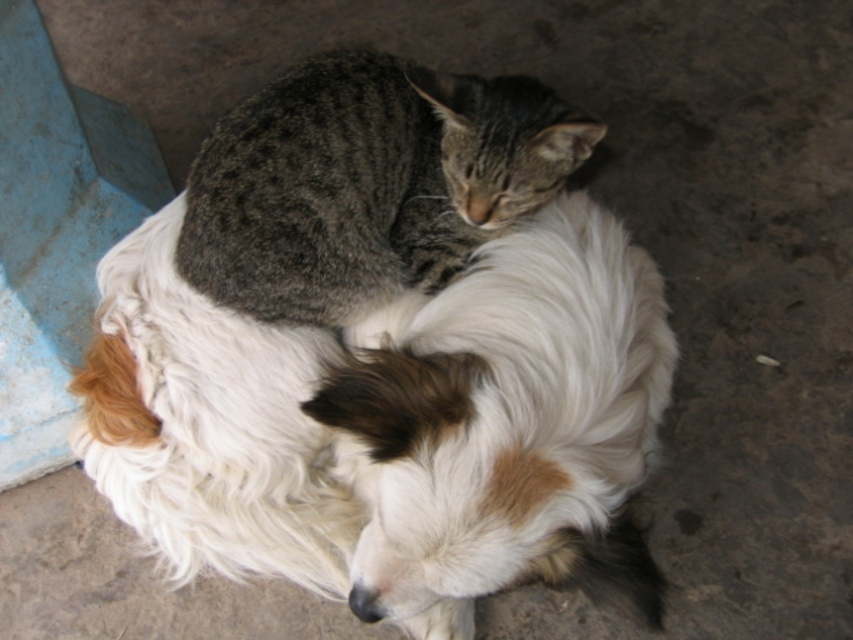
You are holding a 1 meter long stick and want to measure the distance from your current position to the point at coordinates point (428, 413). Can you reach it with your stick?

The point at coordinates point (428, 413) is 1.13 meters from the camera, so the stick of 1 meter is not long enough to reach it.

You are a pet owner who wants to place a small blanket over both the white fluffy dog at center and the gray tabby cat at center. Based on their sizes, which animal would require a larger portion of the blanket?

The white fluffy dog at center is bigger than the gray tabby cat at center, so it would require a larger portion of the blanket.

Looking at this image, you are a photographer standing at the camera position. You want to capture a closeup shot of the white fluffy dog at center without moving the dog. Can you get within 3 feet of the dog to take the photo?

The white fluffy dog at center and camera are 3.56 feet apart from each other, so yes, you can get within 3 feet by moving closer to the dog.